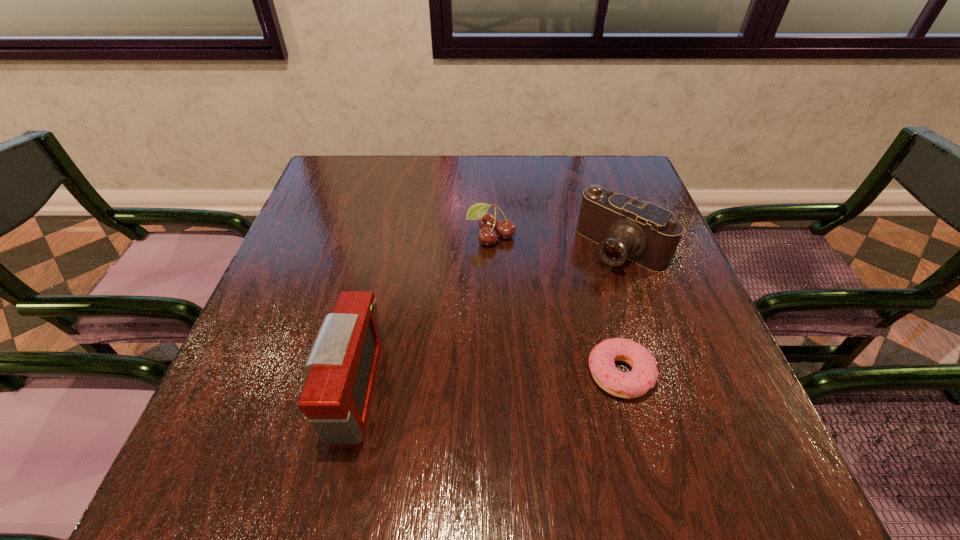
Locate an element on the screen. This screenshot has height=540, width=960. vacant space situated 0.370m on the back of the doughnut is located at coordinates (582, 227).

Identify the location of vacant space located on the leaves of the cherry. This screenshot has width=960, height=540. (501, 388).

Where is `free location located 0.120m on the leaves of the cherry`? free location located 0.120m on the leaves of the cherry is located at coordinates click(494, 287).

Identify the location of vacant space located 0.150m on the leaves of the cherry. (495, 297).

Locate an element on the screen. This screenshot has width=960, height=540. vacant space positioned 0.260m on the front-facing side of the farther camera is located at coordinates (530, 339).

Where is `free location located on the front-facing side of the farther camera`? free location located on the front-facing side of the farther camera is located at coordinates (548, 321).

Identify the location of vacant space located on the front-facing side of the farther camera. (576, 294).

Identify the location of camera at the near edge. Image resolution: width=960 pixels, height=540 pixels. (341, 369).

Locate an element on the screen. The width and height of the screenshot is (960, 540). doughnut positioned at the near edge is located at coordinates (643, 376).

Locate an element on the screen. The width and height of the screenshot is (960, 540). doughnut that is at the right edge is located at coordinates (643, 376).